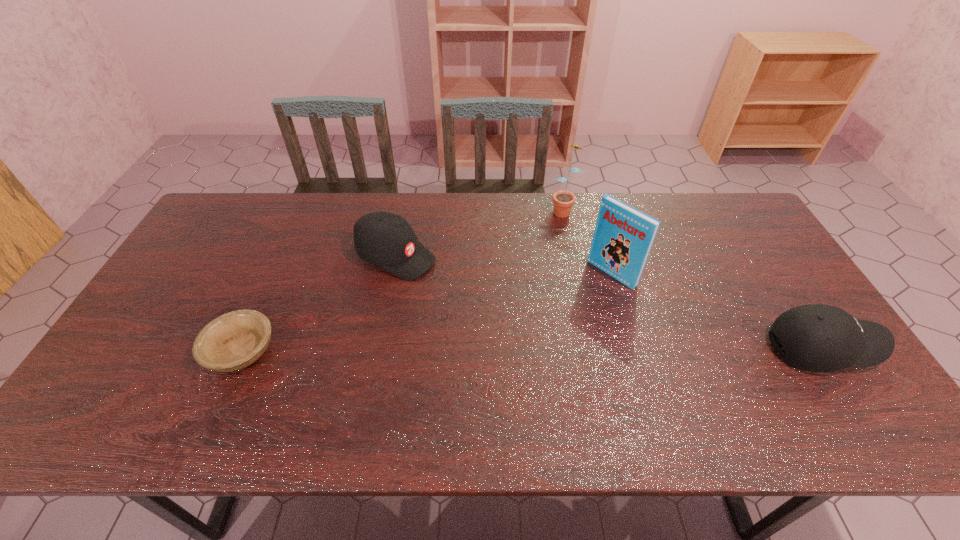
At what (x,y) coordinates should I click in order to perform the action: click on the shortest object. Please return your answer as a coordinate pair (x, y). The image size is (960, 540). Looking at the image, I should click on tap(233, 341).

Image resolution: width=960 pixels, height=540 pixels. Identify the location of the leftmost object. (233, 341).

At what (x,y) coordinates should I click in order to perform the action: click on the rightmost object. Please return your answer as a coordinate pair (x, y). The height and width of the screenshot is (540, 960). Looking at the image, I should click on tap(817, 338).

What are the coordinates of `the right baseball cap` in the screenshot? It's located at (817, 338).

I want to click on the left baseball cap, so click(x=384, y=239).

Where is `the second object from left to right`? The width and height of the screenshot is (960, 540). the second object from left to right is located at coordinates (384, 239).

Find the location of a particular element. Image resolution: width=960 pixels, height=540 pixels. book is located at coordinates (623, 237).

The width and height of the screenshot is (960, 540). Identify the location of sunflower. (563, 200).

The height and width of the screenshot is (540, 960). Identify the location of free space located on the back of the shortest object. (295, 232).

You are a GUI agent. You are given a task and a screenshot of the screen. Output one action in this format:
    pyautogui.click(x=<x>, y=<y>)
    Task: Click on the vacant space located 0.370m with a logo on the front of the fourth object from right to left
    The height and width of the screenshot is (540, 960).
    Given the screenshot: What is the action you would take?
    pyautogui.click(x=540, y=320)